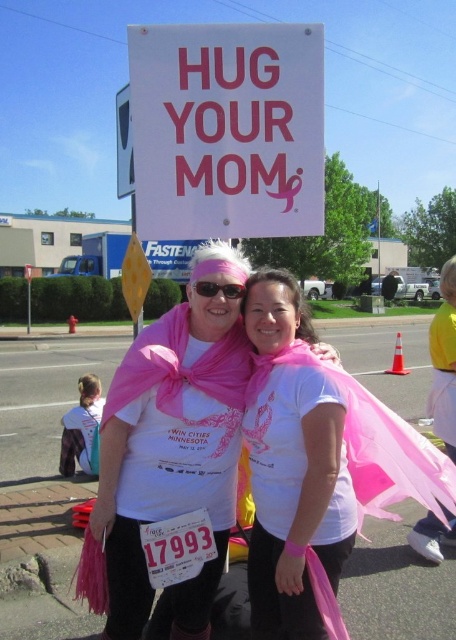
Measure the distance between pink fabric scarf at center and matte black sunglasses at center.

pink fabric scarf at center is 50.81 centimeters from matte black sunglasses at center.

Which is behind, point (279, 403) or point (222, 288)?

Positioned behind is point (222, 288).

The image size is (456, 640). I want to click on pink fabric scarf at center, so click(x=310, y=458).

Who is higher up, white paper sign at upper center or white matte t-shirt at center?

white paper sign at upper center is above.

You are a GUI agent. You are given a task and a screenshot of the screen. Output one action in this format:
    pyautogui.click(x=<x>, y=<y>)
    Task: Click on the white paper sign at upper center
    The height and width of the screenshot is (640, 456).
    Given the screenshot: What is the action you would take?
    pyautogui.click(x=228, y=129)

Who is higher up, white paper sign at upper center or pink fabric scarf at center?

white paper sign at upper center is above.

You are a GUI agent. You are given a task and a screenshot of the screen. Output one action in this format:
    pyautogui.click(x=<x>, y=<y>)
    Task: Click on the white paper sign at upper center
    The width and height of the screenshot is (456, 640).
    Given the screenshot: What is the action you would take?
    (x=228, y=129)